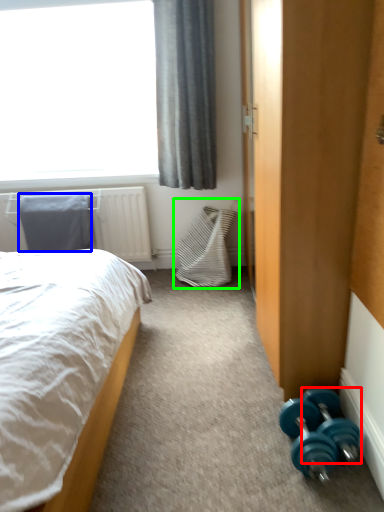
Question: Based on their relative distances, which object is nearer to dumbbell (highlighted by a red box)? Choose from pillow (highlighted by a blue box) and swivel chair (highlighted by a green box).

Choices:
 (A) pillow
 (B) swivel chair

Answer: (B)